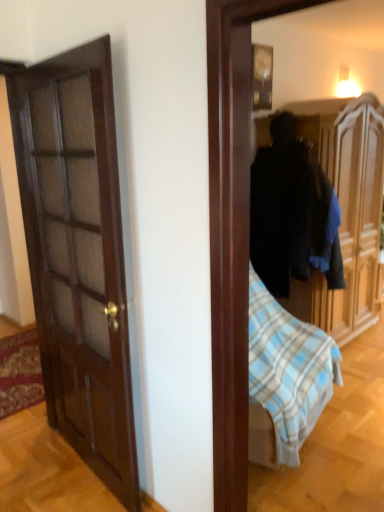
Question: Is the depth of wooden wardrobe at center greater than that of wooden clock at upper center?

Choices:
 (A) no
 (B) yes

Answer: (A)

Question: Is wooden wardrobe at center to the left of wooden clock at upper center from the viewer's perspective?

Choices:
 (A) no
 (B) yes

Answer: (A)

Question: Is wooden clock at upper center inside wooden wardrobe at center?

Choices:
 (A) no
 (B) yes

Answer: (A)

Question: From a real-world perspective, is wooden wardrobe at center positioned under wooden clock at upper center based on gravity?

Choices:
 (A) no
 (B) yes

Answer: (B)

Question: From the image's perspective, is wooden wardrobe at center located above wooden clock at upper center?

Choices:
 (A) yes
 (B) no

Answer: (B)

Question: Is wooden wardrobe at center not inside wooden clock at upper center?

Choices:
 (A) no
 (B) yes

Answer: (B)

Question: Is wooden clock at upper center positioned before wooden wardrobe at center?

Choices:
 (A) no
 (B) yes

Answer: (A)

Question: Can you confirm if wooden clock at upper center is positioned to the right of wooden wardrobe at center?

Choices:
 (A) no
 (B) yes

Answer: (A)

Question: Considering the relative sizes of wooden clock at upper center and wooden wardrobe at center in the image provided, is wooden clock at upper center thinner than wooden wardrobe at center?

Choices:
 (A) no
 (B) yes

Answer: (B)

Question: Can you confirm if wooden clock at upper center is taller than wooden wardrobe at center?

Choices:
 (A) no
 (B) yes

Answer: (A)

Question: Is wooden clock at upper center positioned with its back to wooden wardrobe at center?

Choices:
 (A) yes
 (B) no

Answer: (B)

Question: Is wooden clock at upper center bigger than wooden wardrobe at center?

Choices:
 (A) yes
 (B) no

Answer: (B)

Question: Considering the relative positions of wooden wardrobe at center and wooden clock at upper center in the image provided, is wooden wardrobe at center to the left or to the right of wooden clock at upper center?

Choices:
 (A) right
 (B) left

Answer: (A)